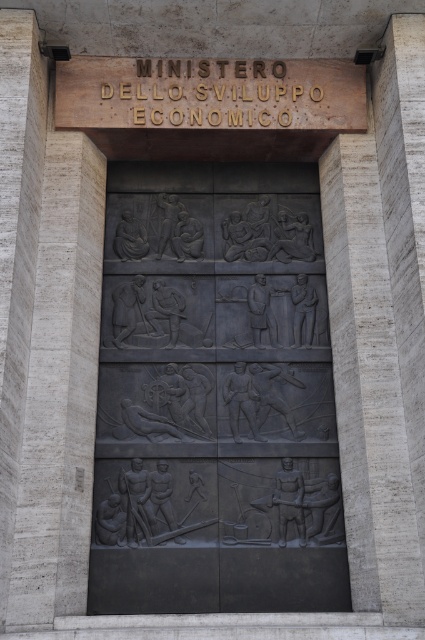
Who is lower down, gray stone pillar at right or gold metallic sign at upper center?

gray stone pillar at right is below.

Does gray stone pillar at right appear under gold metallic sign at upper center?

Indeed, gray stone pillar at right is positioned under gold metallic sign at upper center.

Which is in front, point (410, 48) or point (133, 97)?

Point (410, 48)

Where is `gray stone pillar at right`? This screenshot has height=640, width=425. gray stone pillar at right is located at coordinates (380, 326).

Who is more forward, (181, 228) or (384, 417)?

Point (384, 417)

Is black stone relief at center thinner than gray stone pillar at right?

No, black stone relief at center is not thinner than gray stone pillar at right.

Where is `black stone relief at center`? The width and height of the screenshot is (425, 640). black stone relief at center is located at coordinates (215, 396).

Locate an element on the screen. black stone relief at center is located at coordinates (215, 396).

Can you confirm if black stone relief at center is positioned above gold metallic sign at upper center?

Incorrect, black stone relief at center is not positioned above gold metallic sign at upper center.

Does point (303, 513) come behind point (164, 83)?

No, (303, 513) is in front of (164, 83).

Where is `black stone relief at center`? The height and width of the screenshot is (640, 425). black stone relief at center is located at coordinates (215, 396).

Where is `black stone relief at center`? The height and width of the screenshot is (640, 425). black stone relief at center is located at coordinates (215, 396).